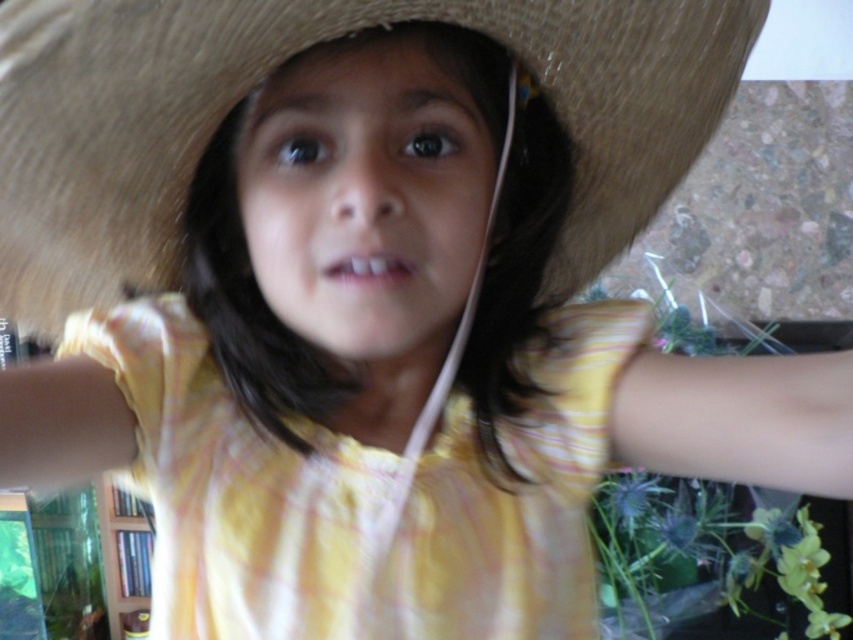
You are a fashion designer working on a childrenswear collection. You want to ensure that the brown straw hat at center and the yellow cotton dress at center can be worn together without the hat obstructing the dress. Given that the hat is 12.82 centimeters away from the dress, is there enough space between them to prevent the hat from covering the dress?

The brown straw hat at center is 12.82 centimeters away from the yellow cotton dress at center. Since the distance between them is more than sufficient, the hat will not obstruct the dress when worn together.

The child is wearing a brown straw hat at center and a yellow cotton dress at center. Which clothing item is positioned higher on the child?

The brown straw hat at center is above the yellow cotton dress at center, so the hat is positioned higher on the child.

You are standing in the room shown in the image and want to reach the point marked at coordinates (634,84). If your arm can reach 18 inches, will you be able to touch that point?

The point at coordinates (634,84) is 19.02 inches away from the camera, so your arm can only reach 18 inches. Therefore, you cannot touch the point at coordinates (634,84) with your arm.